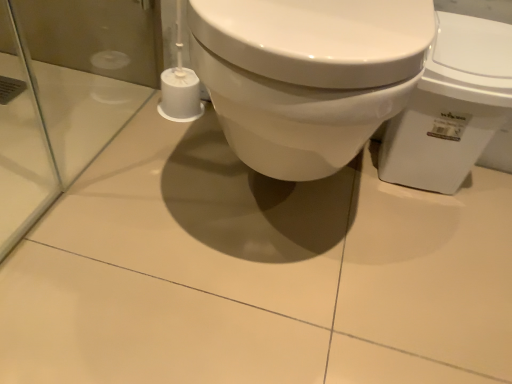
You are a GUI agent. You are given a task and a screenshot of the screen. Output one action in this format:
    pyautogui.click(x=<x>, y=<y>)
    Task: Click on the white glossy toilet at right
    
    Given the screenshot: What is the action you would take?
    pyautogui.click(x=451, y=106)

This screenshot has height=384, width=512. Describe the element at coordinates (451, 106) in the screenshot. I see `white glossy toilet at right` at that location.

What is the approximate width of white glossy toilet at right?

A: The width of white glossy toilet at right is 7.66 inches.

Image resolution: width=512 pixels, height=384 pixels. Describe the element at coordinates (180, 95) in the screenshot. I see `white matte toilet paper at lower left` at that location.

Measure the distance between white matte toilet paper at lower left and camera.

1.09 meters.

Locate an element on the screen. white matte toilet paper at lower left is located at coordinates (180, 95).

At what (x,y) coordinates should I click in order to perform the action: click on white glossy toilet at right. Please return your answer as a coordinate pair (x, y). This screenshot has height=384, width=512. Looking at the image, I should click on (451, 106).

Which is more to the left, white matte toilet paper at lower left or white glossy toilet at right?

Positioned to the left is white matte toilet paper at lower left.

Is white matte toilet paper at lower left further to camera compared to white glossy toilet at right?

Yes, white matte toilet paper at lower left is behind white glossy toilet at right.

Is point (198, 89) closer or farther from the camera than point (477, 120)?

Point (198, 89).

From the image's perspective, is white matte toilet paper at lower left beneath white glossy toilet at right?

No, from the image's perspective, white matte toilet paper at lower left is not beneath white glossy toilet at right.

From a real-world perspective, which is physically above, white matte toilet paper at lower left or white glossy toilet at right?

white glossy toilet at right, from a real-world perspective.

Which object is wider, white matte toilet paper at lower left or white glossy toilet at right?

Wider between the two is white glossy toilet at right.

Who is shorter, white matte toilet paper at lower left or white glossy toilet at right?

With less height is white matte toilet paper at lower left.

Who is bigger, white matte toilet paper at lower left or white glossy toilet at right?

With larger size is white glossy toilet at right.

Would you say white matte toilet paper at lower left contains white glossy toilet at right?

Actually, white glossy toilet at right is outside white matte toilet paper at lower left.

Can you see white matte toilet paper at lower left touching white glossy toilet at right?

No, white matte toilet paper at lower left is not next to white glossy toilet at right.

Is white matte toilet paper at lower left oriented towards white glossy toilet at right?

No, white matte toilet paper at lower left does not turn towards white glossy toilet at right.

What's the angular difference between white matte toilet paper at lower left and white glossy toilet at right's facing directions?

The angular difference between white matte toilet paper at lower left and white glossy toilet at right is 1.32 degrees.

At what (x,y) coordinates should I click in order to perform the action: click on toilet positioned vertically above the white matte toilet paper at lower left (from a real-world perspective). Please return your answer as a coordinate pair (x, y). This screenshot has height=384, width=512. Looking at the image, I should click on (451, 106).

Visually, is white glossy toilet at right positioned to the left or to the right of white matte toilet paper at lower left?

white glossy toilet at right is positioned on white matte toilet paper at lower left's right side.

Is white glossy toilet at right in front of white matte toilet paper at lower left?

Yes, white glossy toilet at right is closer to the camera.

Does point (451, 57) lie behind point (174, 103)?

That is False.

From the image's perspective, which one is positioned lower, white glossy toilet at right or white matte toilet paper at lower left?

white glossy toilet at right is shown below in the image.

Based on the photo, from a real-world perspective, between white glossy toilet at right and white matte toilet paper at lower left, who is vertically lower?

white matte toilet paper at lower left, from a real-world perspective.

Can you confirm if white glossy toilet at right is thinner than white matte toilet paper at lower left?

In fact, white glossy toilet at right might be wider than white matte toilet paper at lower left.

Is white glossy toilet at right taller than white matte toilet paper at lower left?

Correct, white glossy toilet at right is much taller as white matte toilet paper at lower left.

In terms of size, does white glossy toilet at right appear bigger or smaller than white matte toilet paper at lower left?

Considering their sizes, white glossy toilet at right takes up more space than white matte toilet paper at lower left.

Is white matte toilet paper at lower left a part of white glossy toilet at right?

Actually, white matte toilet paper at lower left is outside white glossy toilet at right.

Are white glossy toilet at right and white matte toilet paper at lower left making contact?

No, white glossy toilet at right is not in contact with white matte toilet paper at lower left.

Is white glossy toilet at right positioned with its back to white matte toilet paper at lower left?

No, white glossy toilet at right's orientation is not away from white matte toilet paper at lower left.

How many degrees apart are the facing directions of white glossy toilet at right and white matte toilet paper at lower left?

The angular difference between white glossy toilet at right and white matte toilet paper at lower left is 1.32 degrees.

This screenshot has width=512, height=384. I want to click on toilet on the right of white matte toilet paper at lower left, so click(x=451, y=106).

Image resolution: width=512 pixels, height=384 pixels. In order to click on toilet that appears below the white matte toilet paper at lower left (from the image's perspective) in this screenshot , I will do `click(451, 106)`.

Where is `toilet above the white matte toilet paper at lower left (from a real-world perspective)`? The image size is (512, 384). toilet above the white matte toilet paper at lower left (from a real-world perspective) is located at coordinates (451, 106).